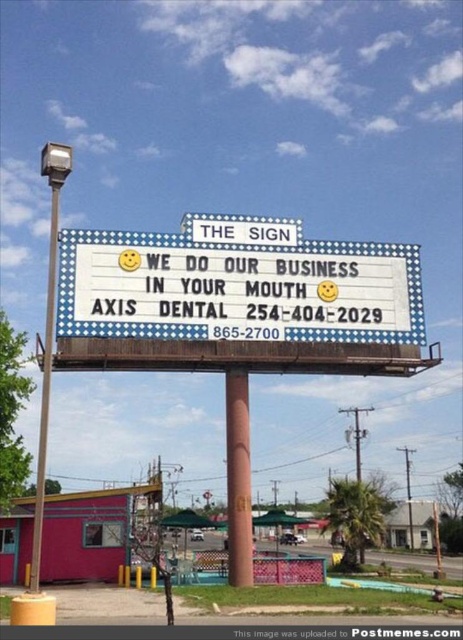
Question: Is white plastic marquee board at center to the left of brown painted wood pole at center from the viewer's perspective?

Choices:
 (A) no
 (B) yes

Answer: (A)

Question: Is brown painted wood pole at center thinner than metallic pole at left?

Choices:
 (A) yes
 (B) no

Answer: (A)

Question: Which is farther from the white plastic marquee board at center?

Choices:
 (A) brown painted wood pole at center
 (B) metallic pole at left

Answer: (B)

Question: Which of these objects is positioned closest to the brown painted wood pole at center?

Choices:
 (A) metallic pole at left
 (B) white plastic marquee board at center

Answer: (B)

Question: Which object is the closest to the metallic pole at left?

Choices:
 (A) white plastic marquee board at center
 (B) brown painted wood pole at center

Answer: (A)

Question: Does brown painted wood pole at center appear on the left side of metallic pole at left?

Choices:
 (A) no
 (B) yes

Answer: (A)